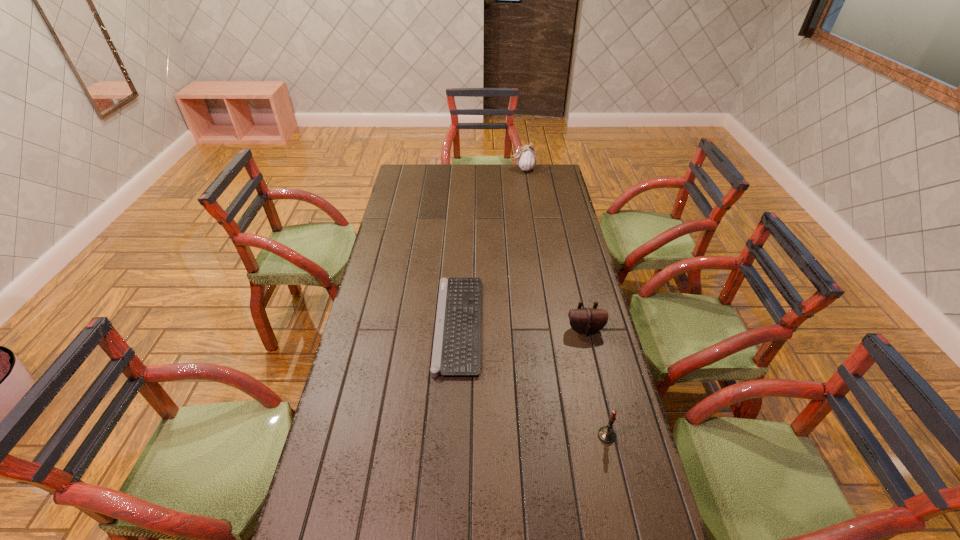
At what (x,y) coordinates should I click in order to perform the action: click on blank space located 0.100m on the back of the candle. Please return your answer as a coordinate pair (x, y). Looking at the image, I should click on (598, 396).

The width and height of the screenshot is (960, 540). What are the coordinates of `vacant space located 0.330m with the flap open on the right pouch` in the screenshot? It's located at (608, 428).

The height and width of the screenshot is (540, 960). In order to click on vacant space located 0.300m on the right of the shortest object in this screenshot , I will do `click(568, 324)`.

Find the location of a particular element. The width and height of the screenshot is (960, 540). object present at the far edge is located at coordinates (526, 158).

The width and height of the screenshot is (960, 540). I want to click on candle that is at the right edge, so click(x=606, y=434).

Image resolution: width=960 pixels, height=540 pixels. I want to click on object situated at the far right corner, so click(526, 158).

At what (x,y) coordinates should I click in order to perform the action: click on vacant point at the far edge. Please return your answer as a coordinate pair (x, y). The image size is (960, 540). Looking at the image, I should click on (451, 167).

Image resolution: width=960 pixels, height=540 pixels. I want to click on blank space at the left edge, so click(x=394, y=241).

Find the location of a particular element. free point at the right edge is located at coordinates (547, 259).

Image resolution: width=960 pixels, height=540 pixels. In order to click on free point at the far left corner in this screenshot , I will do `click(406, 171)`.